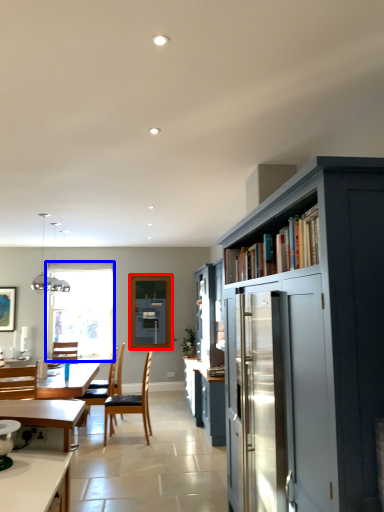
Question: Which point is closer to the camera, window screen (highlighted by a red box) or window (highlighted by a blue box)?

Choices:
 (A) window screen
 (B) window

Answer: (A)